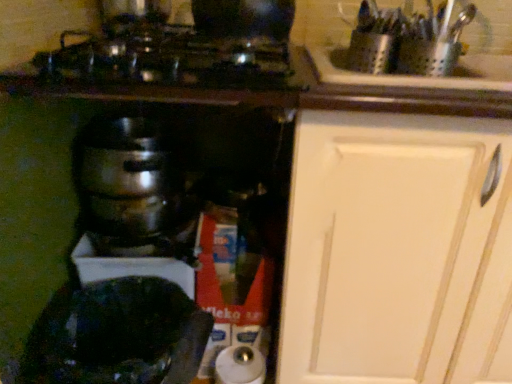
Question: Considering the relative sizes of shiny black pot at lower left and white matte cabinet at upper right in the image provided, is shiny black pot at lower left thinner than white matte cabinet at upper right?

Choices:
 (A) yes
 (B) no

Answer: (A)

Question: From a real-world perspective, is shiny black pot at lower left located higher than white matte cabinet at upper right?

Choices:
 (A) yes
 (B) no

Answer: (B)

Question: Can you see shiny black pot at lower left touching white matte cabinet at upper right?

Choices:
 (A) yes
 (B) no

Answer: (B)

Question: Is shiny black pot at lower left bigger than white matte cabinet at upper right?

Choices:
 (A) yes
 (B) no

Answer: (B)

Question: Can you confirm if shiny black pot at lower left is wider than white matte cabinet at upper right?

Choices:
 (A) no
 (B) yes

Answer: (A)

Question: Considering the relative sizes of shiny black pot at lower left and white matte cabinet at upper right in the image provided, is shiny black pot at lower left shorter than white matte cabinet at upper right?

Choices:
 (A) yes
 (B) no

Answer: (A)

Question: Is shiny black pot at lower left closer to the viewer compared to shiny metallic cookware at upper center?

Choices:
 (A) no
 (B) yes

Answer: (A)

Question: Does shiny black pot at lower left appear on the left side of shiny metallic cookware at upper center?

Choices:
 (A) yes
 (B) no

Answer: (A)

Question: Does shiny black pot at lower left have a greater width compared to shiny metallic cookware at upper center?

Choices:
 (A) yes
 (B) no

Answer: (B)

Question: Is shiny black pot at lower left oriented towards shiny metallic cookware at upper center?

Choices:
 (A) no
 (B) yes

Answer: (A)

Question: Does shiny black pot at lower left touch shiny metallic cookware at upper center?

Choices:
 (A) no
 (B) yes

Answer: (A)

Question: From a real-world perspective, does shiny black pot at lower left sit lower than shiny metallic cookware at upper center?

Choices:
 (A) yes
 (B) no

Answer: (A)

Question: Can you confirm if white matte cabinet at upper right is shorter than shiny metallic cookware at upper center?

Choices:
 (A) yes
 (B) no

Answer: (B)